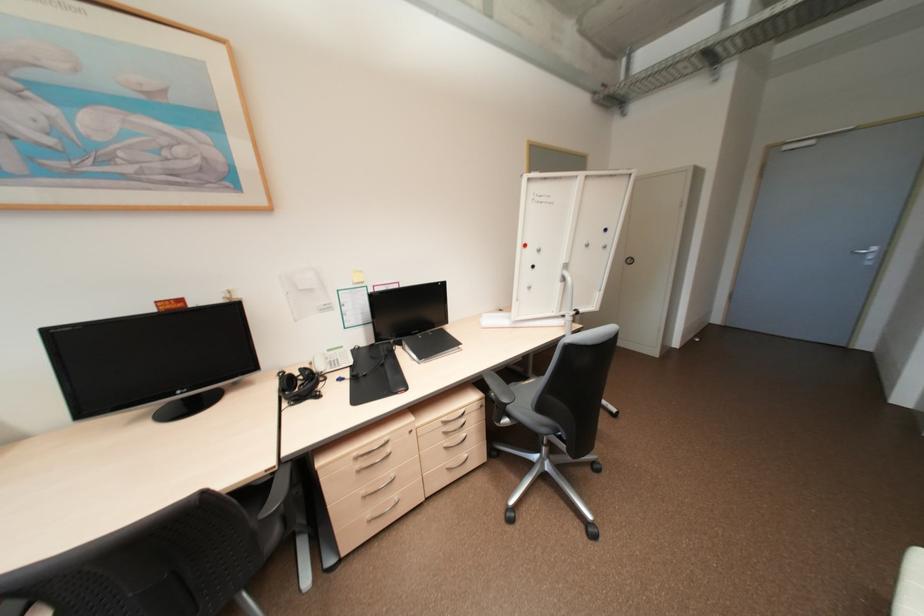
This screenshot has height=616, width=924. Describe the element at coordinates (299, 385) in the screenshot. I see `the telephone handset` at that location.